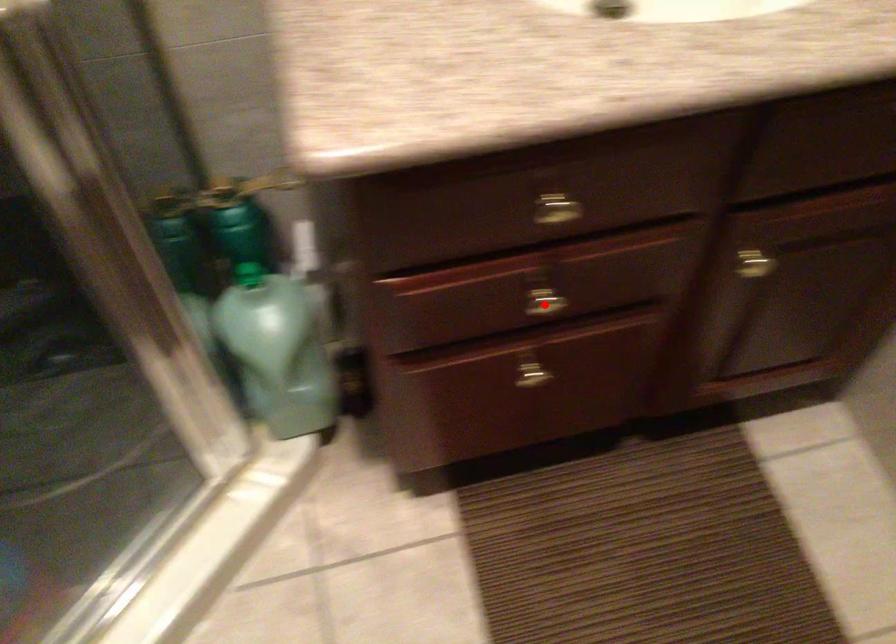
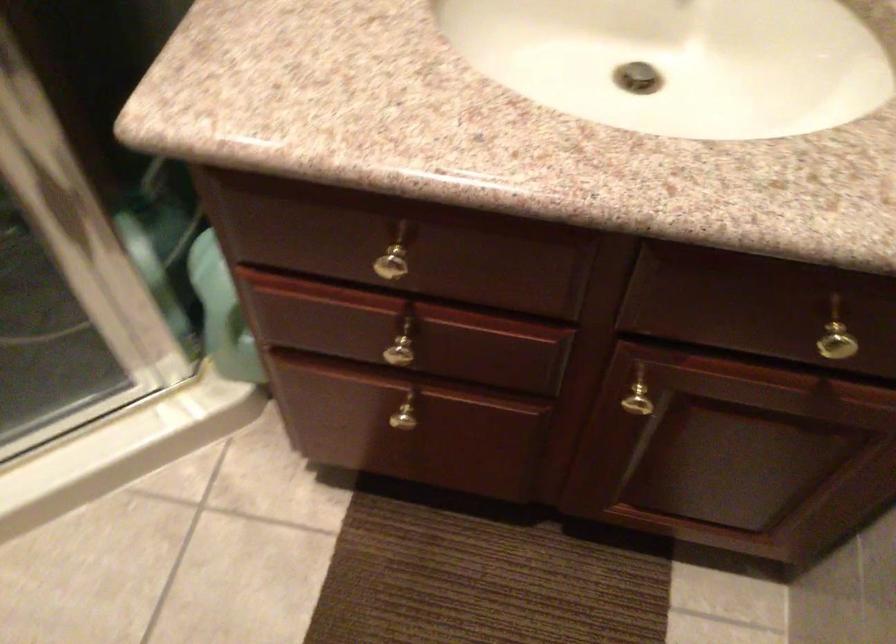
The point at the highlighted location is marked in the first image. Where is the corresponding point in the second image?

(401, 354)